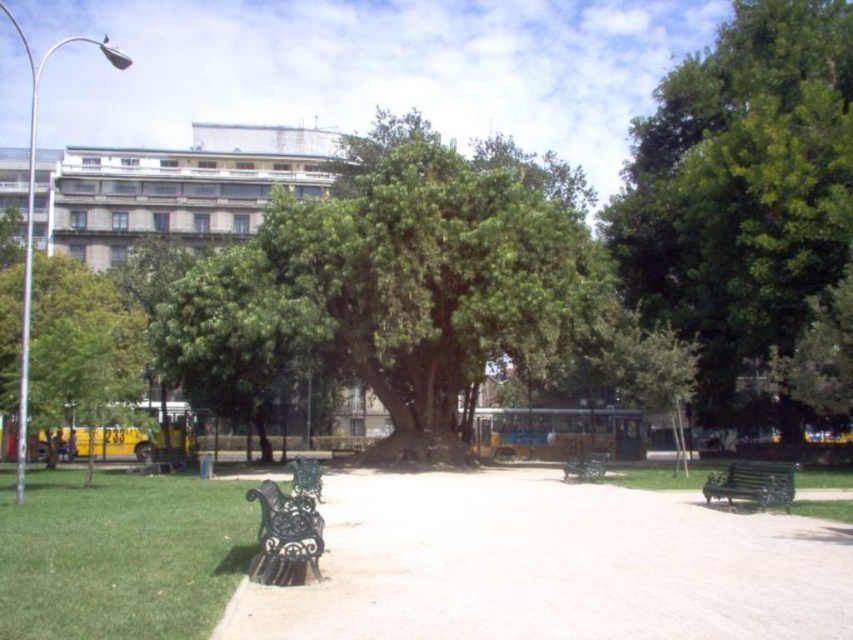
Question: Which point is closer to the camera?

Choices:
 (A) black wrought iron bench at center
 (B) green leafy tree at center
 (C) green grass at lower left
 (D) black wrought iron bench at lower left

Answer: (C)

Question: Which point is closer to the camera taking this photo?

Choices:
 (A) (726, 154)
 (B) (698, 536)
 (C) (274, 513)

Answer: (C)

Question: Is the position of green leafy tree at center more distant than that of green wrought iron bench at lower right?

Choices:
 (A) yes
 (B) no

Answer: (A)

Question: Is black wrought iron bench at lower left in front of black wrought iron bench at center?

Choices:
 (A) yes
 (B) no

Answer: (A)

Question: Is smooth concrete pavement at center to the right of green grass at lower left from the viewer's perspective?

Choices:
 (A) yes
 (B) no

Answer: (A)

Question: Which of the following is the closest to the observer?

Choices:
 (A) (595, 456)
 (B) (57, 424)
 (C) (730, 477)

Answer: (C)